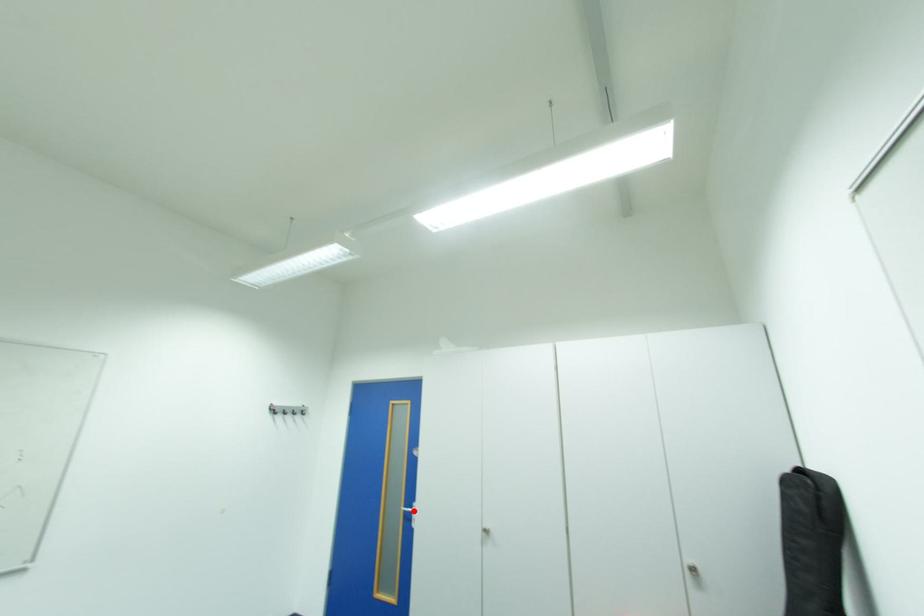
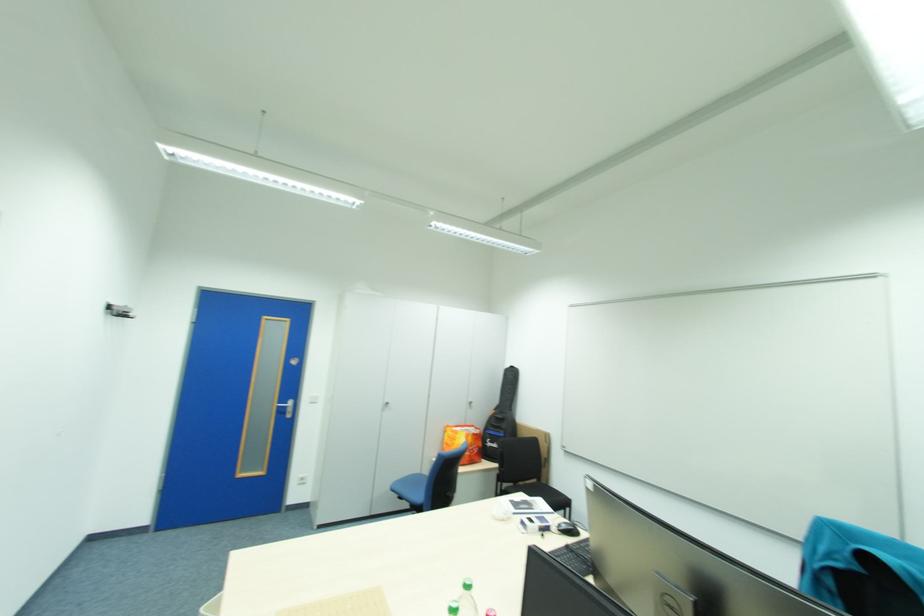
Find the pixel in the second image that matches the highlighted location in the first image.

(286, 407)